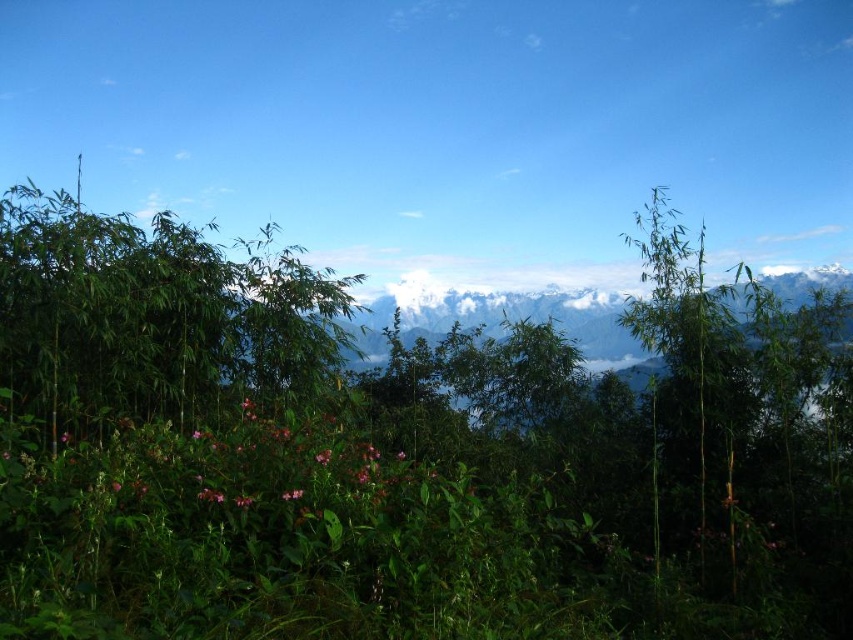
Between green bamboo at left and pink matte flower at lower left, which one is positioned lower?

pink matte flower at lower left is below.

Is green bamboo at left positioned behind pink matte flower at lower left?

No, green bamboo at left is in front of pink matte flower at lower left.

Locate an element on the screen. green bamboo at left is located at coordinates (151, 314).

Between pink matte flowers at lower left and pink matte flower at lower left, which one is positioned higher?

pink matte flower at lower left is above.

Does pink matte flowers at lower left have a larger size compared to pink matte flower at lower left?

Yes, pink matte flowers at lower left is bigger than pink matte flower at lower left.

The width and height of the screenshot is (853, 640). What do you see at coordinates (233, 461) in the screenshot?
I see `pink matte flowers at lower left` at bounding box center [233, 461].

Identify the location of pink matte flowers at lower left. (233, 461).

Is point (254, 481) closer to viewer compared to point (238, 496)?

That is False.

Where is `pink matte flowers at lower left`? The image size is (853, 640). pink matte flowers at lower left is located at coordinates (233, 461).